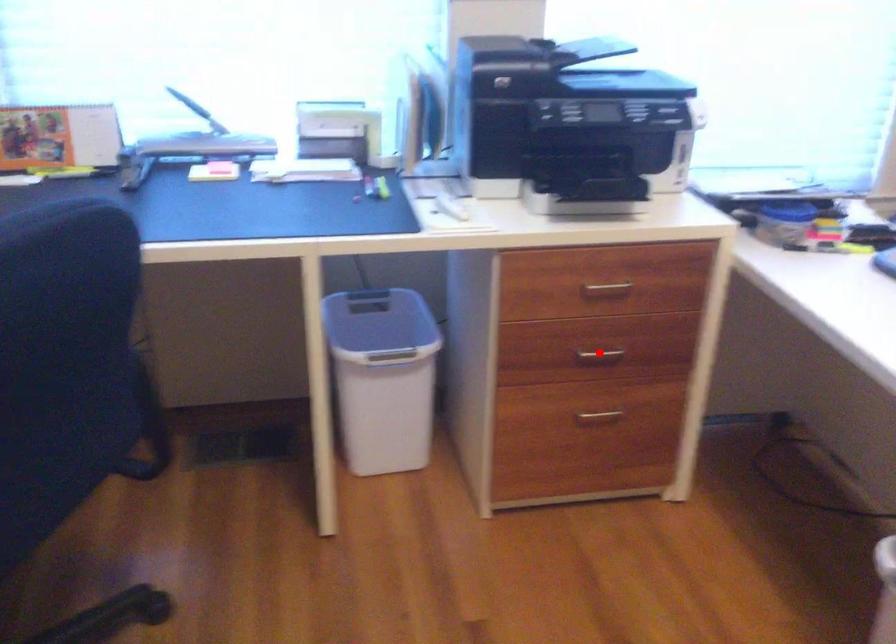
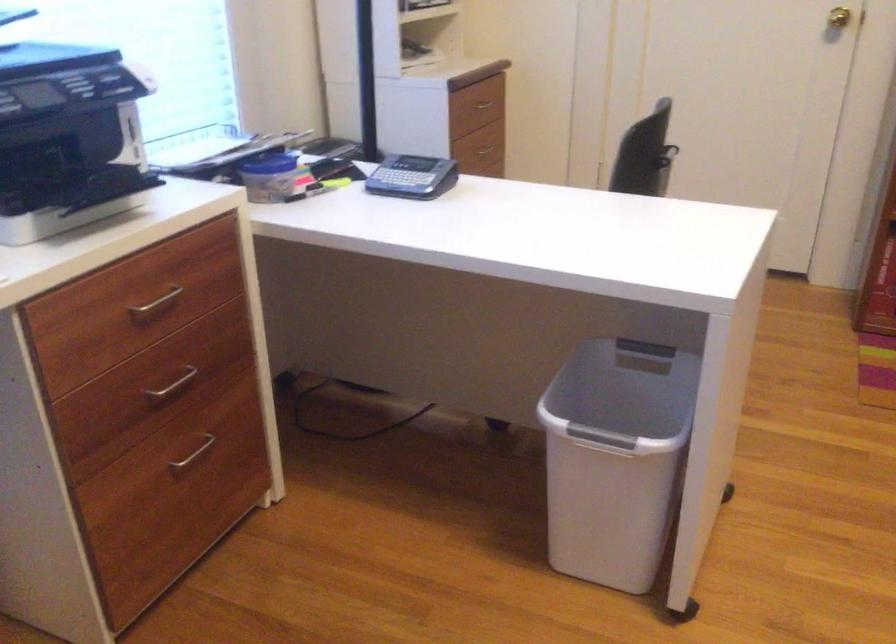
Question: I am providing you with two images of the same scene from different viewpoints. A red point is shown in image1. For the corresponding object point in image2, is it positioned nearer or farther from the camera?

Choices:
 (A) Nearer
 (B) Farther

Answer: (A)